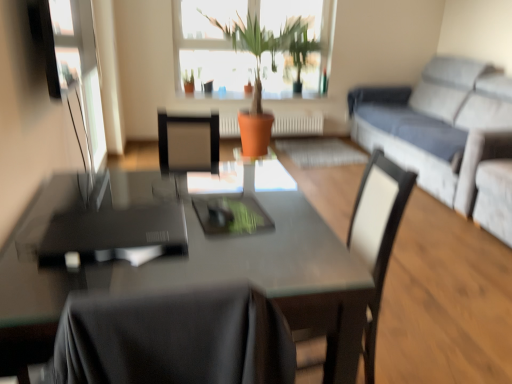
Question: From the image's perspective, is glossy glass table at center located beneath white leather chair at center?

Choices:
 (A) no
 (B) yes

Answer: (B)

Question: Considering the relative sizes of glossy glass table at center and white leather chair at center in the image provided, is glossy glass table at center taller than white leather chair at center?

Choices:
 (A) yes
 (B) no

Answer: (B)

Question: Is glossy glass table at center facing towards white leather chair at center?

Choices:
 (A) yes
 (B) no

Answer: (A)

Question: From a real-world perspective, is glossy glass table at center physically above white leather chair at center?

Choices:
 (A) yes
 (B) no

Answer: (B)

Question: Is glossy glass table at center outside of white leather chair at center?

Choices:
 (A) no
 (B) yes

Answer: (B)

Question: Is glossy glass table at center beside white leather chair at center?

Choices:
 (A) yes
 (B) no

Answer: (B)

Question: Is light gray fabric couch at right not close to glossy glass table at center?

Choices:
 (A) yes
 (B) no

Answer: (A)

Question: From a real-world perspective, is light gray fabric couch at right positioned over glossy glass table at center based on gravity?

Choices:
 (A) no
 (B) yes

Answer: (B)

Question: Is light gray fabric couch at right next to glossy glass table at center and touching it?

Choices:
 (A) yes
 (B) no

Answer: (B)

Question: Is light gray fabric couch at right turned away from glossy glass table at center?

Choices:
 (A) yes
 (B) no

Answer: (B)

Question: Considering the relative sizes of light gray fabric couch at right and glossy glass table at center in the image provided, is light gray fabric couch at right thinner than glossy glass table at center?

Choices:
 (A) no
 (B) yes

Answer: (A)

Question: Considering the relative sizes of light gray fabric couch at right and glossy glass table at center in the image provided, is light gray fabric couch at right bigger than glossy glass table at center?

Choices:
 (A) no
 (B) yes

Answer: (B)

Question: From a real-world perspective, is terracotta clay pot at center over light gray fabric couch at right?

Choices:
 (A) yes
 (B) no

Answer: (A)